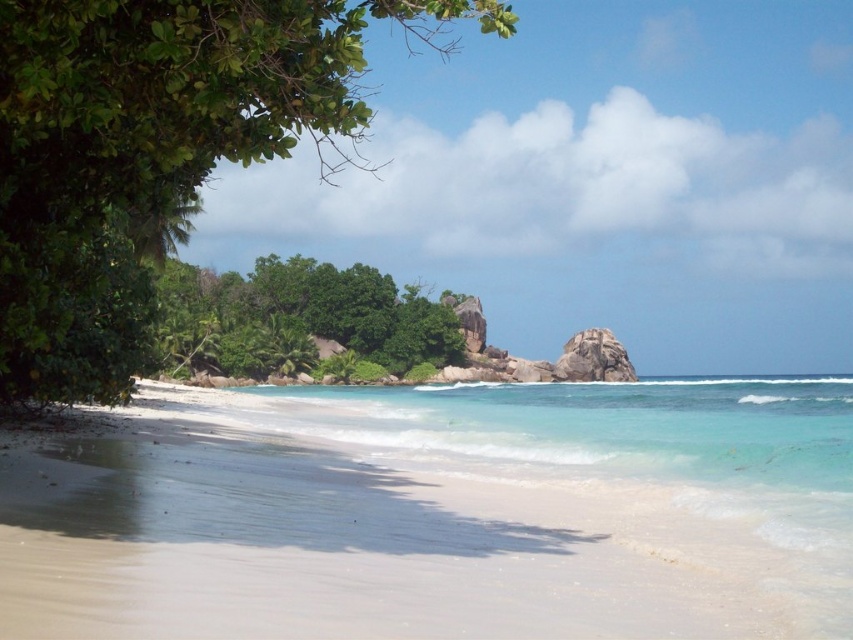
Question: Which of the following is the farthest from the observer?

Choices:
 (A) (242, 460)
 (B) (140, 212)

Answer: (B)

Question: Among these points, which one is nearest to the camera?

Choices:
 (A) (825, 627)
 (B) (582, 474)

Answer: (A)

Question: Is clear blue water at center to the right of green leafy tree at center from the viewer's perspective?

Choices:
 (A) yes
 (B) no

Answer: (A)

Question: Can you confirm if green leafy tree at upper left is bigger than green leafy tree at center?

Choices:
 (A) yes
 (B) no

Answer: (A)

Question: Among these objects, which one is nearest to the camera?

Choices:
 (A) green leafy tree at center
 (B) green leafy tree at upper left

Answer: (B)

Question: Is clear blue water at center closer to the viewer compared to smooth granite rock at center?

Choices:
 (A) yes
 (B) no

Answer: (A)